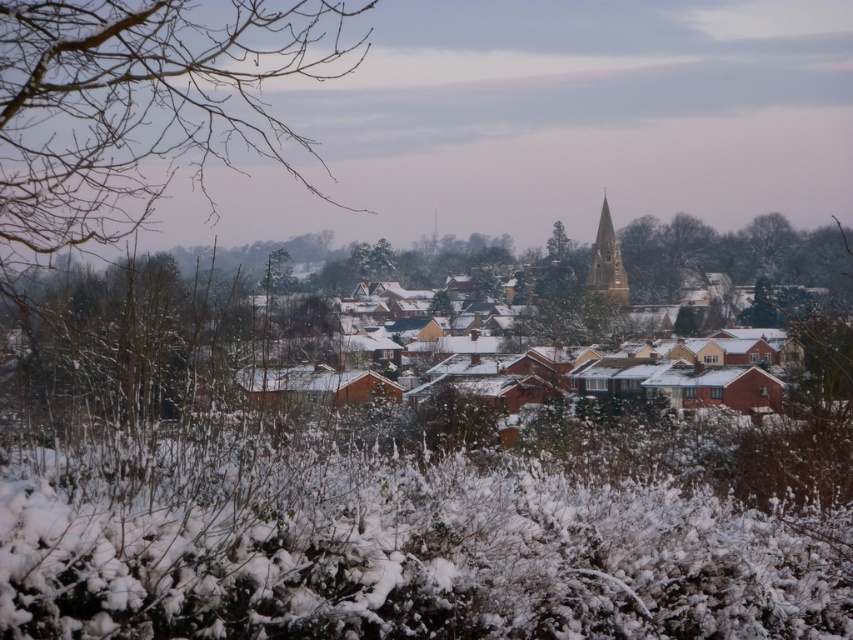
Question: Among these objects, which one is farthest from the camera?

Choices:
 (A) green leafy tree at center
 (B) bare branches at left

Answer: (A)

Question: Estimate the real-world distances between objects in this image. Which object is closer to the bare branches at left?

Choices:
 (A) golden stone spire at center
 (B) green leafy tree at center

Answer: (B)

Question: Can you confirm if bare branches at left is thinner than green leafy tree at center?

Choices:
 (A) yes
 (B) no

Answer: (B)

Question: Can you confirm if bare branches at left is smaller than green leafy tree at center?

Choices:
 (A) yes
 (B) no

Answer: (B)

Question: Which point is closer to the camera?

Choices:
 (A) [566, 234]
 (B) [82, 163]
 (C) [598, 224]

Answer: (B)

Question: Is golden stone spire at center smaller than green leafy tree at center?

Choices:
 (A) no
 (B) yes

Answer: (B)